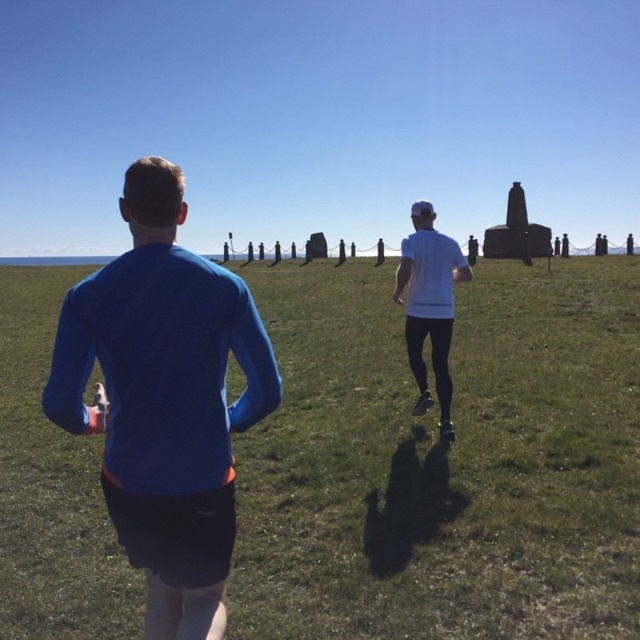
You are a drone operator who needs to capture a photo of the blue fabric shirt at center and green grass at center. The camera has a maximum focus range of 10 meters. Can the drone capture both subjects in focus at the same time?

The distance between the green grass at center and blue fabric shirt at center is 10.45 meters. Since the camera can only focus within 10 meters, the drone cannot capture both subjects in focus simultaneously.

You are a photographer positioned at the edge of the field. You want to capture a photo where both the blue fabric shirt at center and the white matte shirt at center are clearly visible. Based on their positions, which runner should you focus on to ensure both are in the frame?

The blue fabric shirt at center is in front of the white matte shirt at center. To ensure both are clearly visible in the photo, focus on the blue fabric shirt at center since it is closer to you, allowing the white matte shirt at center to remain in the background within the frame.

You are a photographer trying to capture both the green grass at center and the white matte shirt at center in the same frame. Which object should you focus on first to ensure both are in the frame?

The green grass at center is larger in size than the white matte shirt at center, so you should focus on the green grass at center first to ensure both fit in the frame.